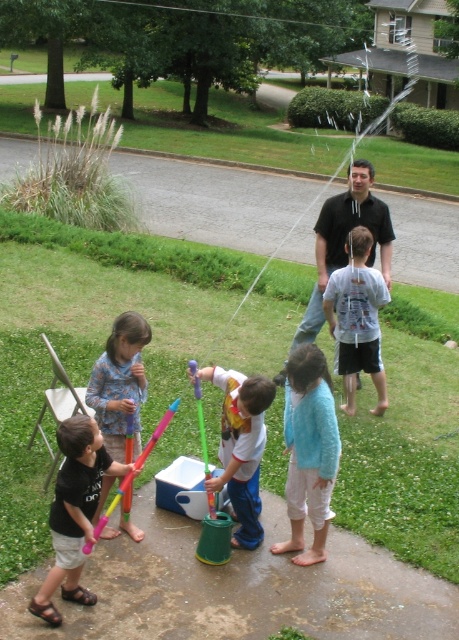
In the scene shown: You are a photographer trying to capture a candid shot of the children playing with water. You notice two shirts in the scene, a matte black shirt at lower left and a white cotton shirt at center. Which shirt is positioned lower in the image?

The matte black shirt at lower left is positioned lower in the image than the white cotton shirt at center.

You are standing at the point labeled as point (73, 512) in the image. Looking around, you see a group of children playing with water guns on a wet ground. What is the nearest object to you at this point?

The nearest object to point (73, 512) is the matte black shirt at lower left, as the point is located on it.